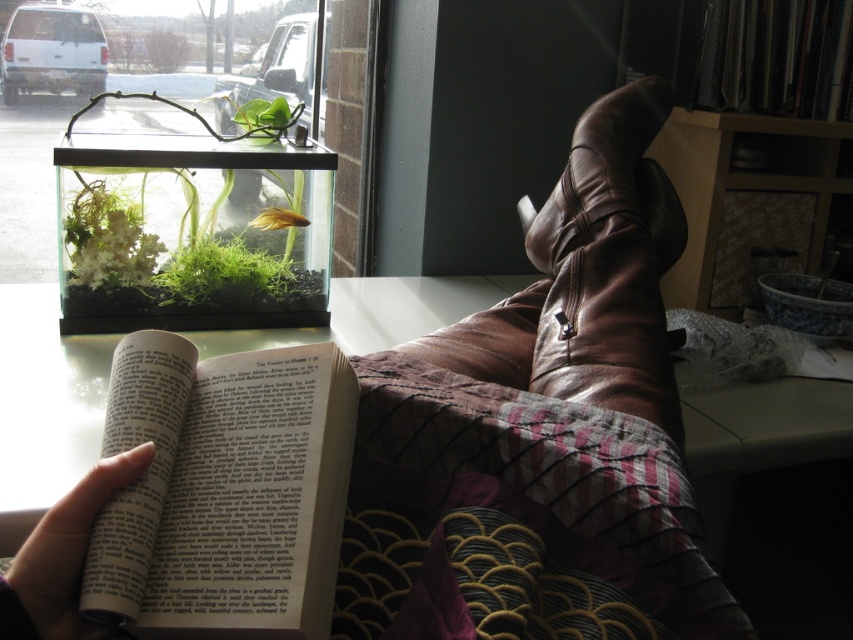
Can you confirm if paperback book at center is positioned to the left of green mossy plant at upper left?

In fact, paperback book at center is to the right of green mossy plant at upper left.

Based on the photo, does paperback book at center have a lesser height compared to green mossy plant at upper left?

Yes, paperback book at center is shorter than green mossy plant at upper left.

Which is behind, point (231, 484) or point (83, 148)?

The point (83, 148) is behind.

Find the location of a particular element. The height and width of the screenshot is (640, 853). paperback book at center is located at coordinates (224, 490).